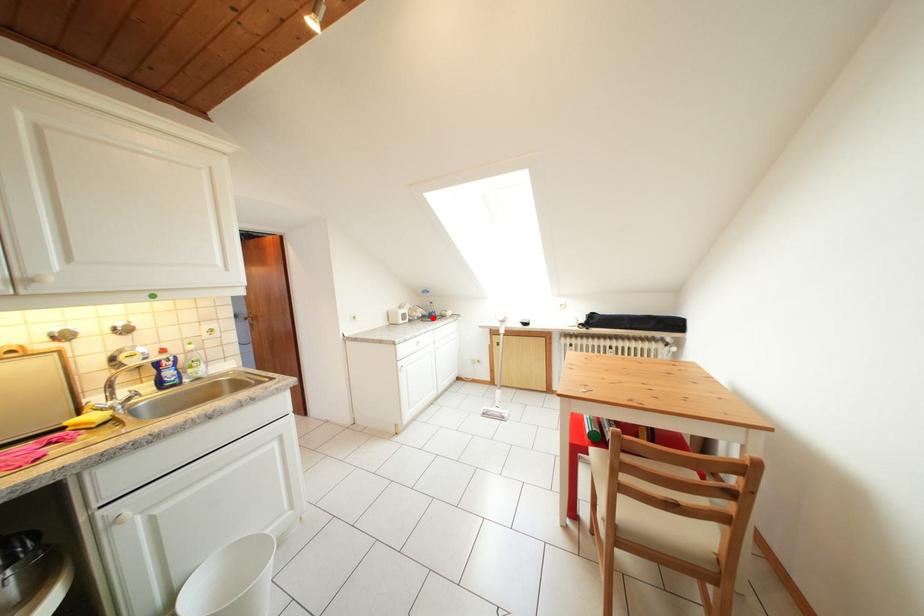
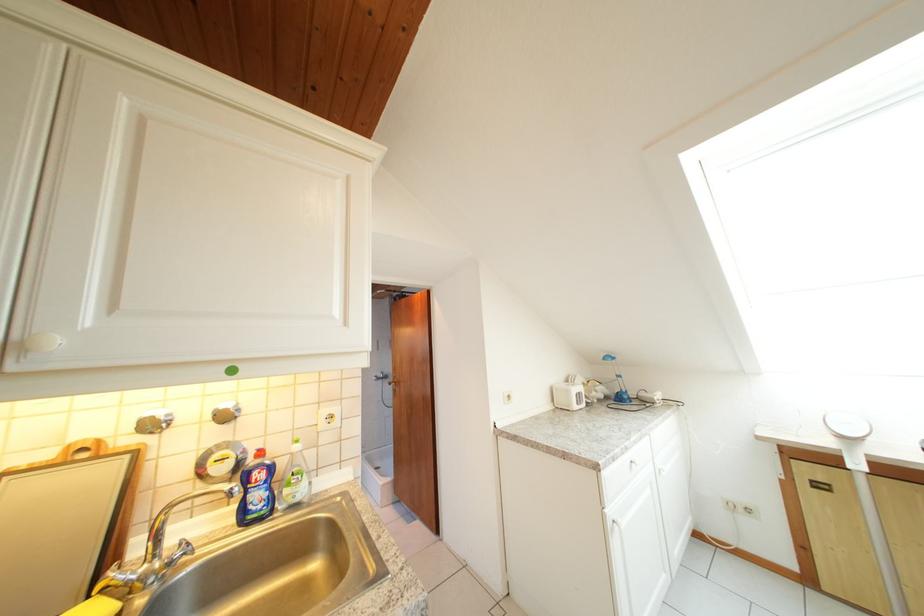
Question: I am providing you with two images of the same scene from different viewpoints. Image1 has a red point marked. In image2, the corresponding 3D location appears at what relative position? Reply with the corresponding letter.

Choices:
 (A) Closer
 (B) Farther

Answer: (B)